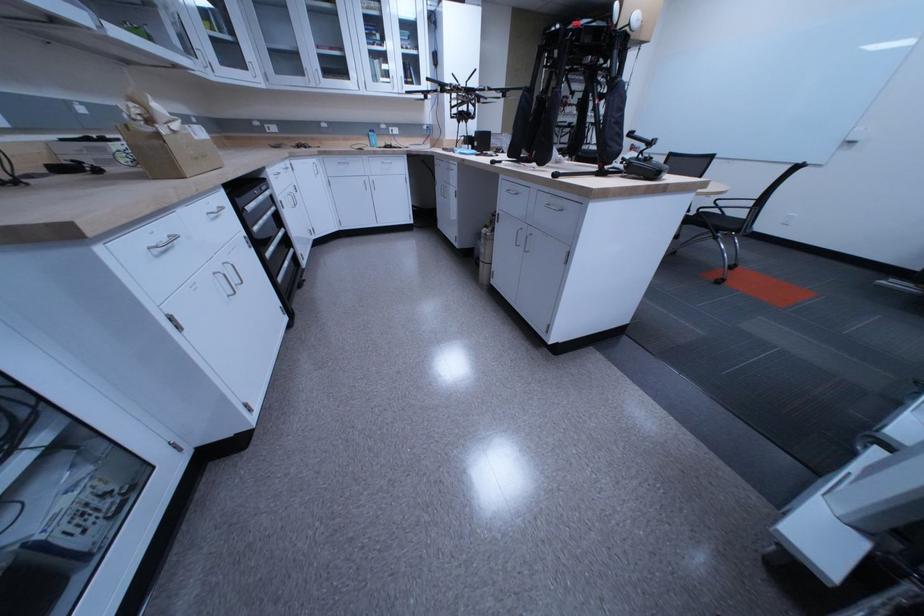
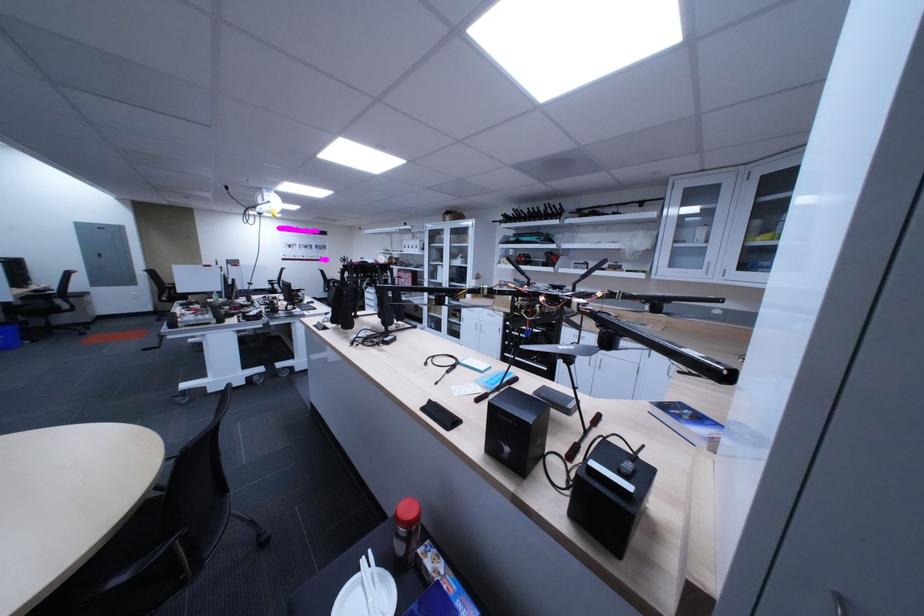
Question: I am providing you with two images of the same scene from different viewpoints. Please identify which objects are invisible in image2.

Choices:
 (A) white drawer handle
 (B) light wood drawer
 (C) white cabinet handle
 (D) red plastic bottle

Answer: (A)